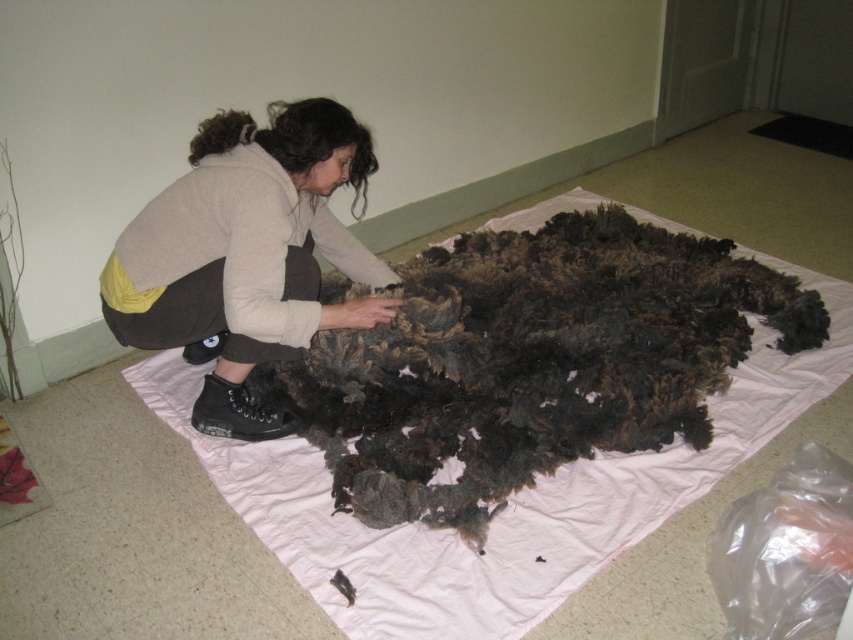
You are organizing a craft fair and need to arrange items from left to right. You have a fuzzy woolen blanket at center and a matte beige sweater at center. Based on their positions in the image, which item should you place first from the left?

The matte beige sweater at center should be placed first from the left because the fuzzy woolen blanket at center is to the right of it in the image.

From the picture: You are organizing a craft fair and need to display the fuzzy woolen blanket at center and the matte beige sweater at center. Which item should be placed on the wider display stand to ensure proper visibility?

The fuzzy woolen blanket at center should be placed on the wider display stand because it might be wider than the matte beige sweater at center.

You are a delivery person who needs to place a small box between the fuzzy woolen blanket at center and the matte beige sweater at center. The box is 12 inches long. Can you fit it between them without moving either item?

The distance between the fuzzy woolen blanket at center and the matte beige sweater at center is 22.44 inches. Since the box is only 12 inches long, it can easily fit between them without needing to move either item.